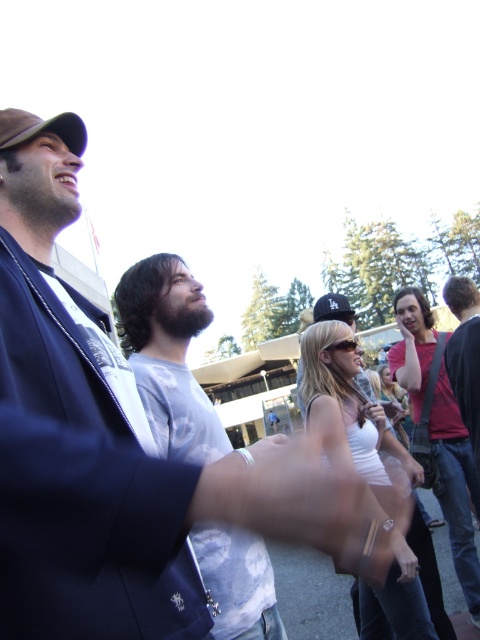
Question: Which of these objects is positioned farthest from the dark blue jacket at left?

Choices:
 (A) black matte baseball cap at upper center
 (B) matte red shirt at right
 (C) matte black sunglasses at center

Answer: (A)

Question: Among these points, which one is farthest from the camera?

Choices:
 (A) (322, 305)
 (B) (147, 275)
 (C) (479, 337)
 (D) (48, 392)

Answer: (A)

Question: Does dark red shirt at right appear under matte black sunglasses at center?

Choices:
 (A) no
 (B) yes

Answer: (B)

Question: Does gray cotton t-shirt at center appear on the left side of black matte baseball cap at upper center?

Choices:
 (A) yes
 (B) no

Answer: (A)

Question: Considering the relative positions of gray cotton t-shirt at center and white matte tank top at center in the image provided, where is gray cotton t-shirt at center located with respect to white matte tank top at center?

Choices:
 (A) above
 (B) below

Answer: (A)

Question: Which object is the closest to the dark blue jacket at left?

Choices:
 (A) black matte baseball cap at upper center
 (B) matte red shirt at right
 (C) matte black sunglasses at center
 (D) dark red shirt at right

Answer: (C)